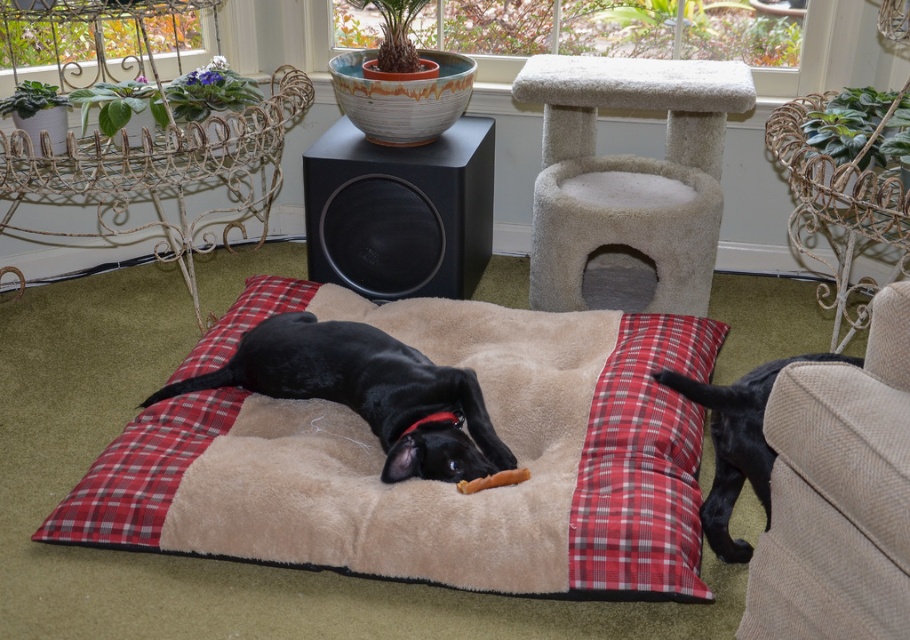
Can you confirm if beige fleece dog bed at center is positioned below black matte speaker at center?

Indeed, beige fleece dog bed at center is positioned under black matte speaker at center.

Between beige fleece dog bed at center and black matte speaker at center, which one appears on the right side from the viewer's perspective?

beige fleece dog bed at center

Who is more distant from viewer, (364, 317) or (469, 248)?

Point (469, 248)

This screenshot has height=640, width=910. What are the coordinates of `beige fleece dog bed at center` in the screenshot? It's located at (423, 481).

Which is more to the left, beige fleece dog bed at center or red plaid pillow at lower center?

Positioned to the left is beige fleece dog bed at center.

Does beige fleece dog bed at center appear on the left side of red plaid pillow at lower center?

Yes, beige fleece dog bed at center is to the left of red plaid pillow at lower center.

This screenshot has height=640, width=910. What are the coordinates of `beige fleece dog bed at center` in the screenshot? It's located at (423, 481).

Which is more to the right, beige fleece dog bed at center or black fur dog at lower right?

black fur dog at lower right is more to the right.

Is point (69, 493) less distant than point (715, 419)?

No.

The height and width of the screenshot is (640, 910). What do you see at coordinates (423, 481) in the screenshot? I see `beige fleece dog bed at center` at bounding box center [423, 481].

Image resolution: width=910 pixels, height=640 pixels. I want to click on beige fleece dog bed at center, so click(423, 481).